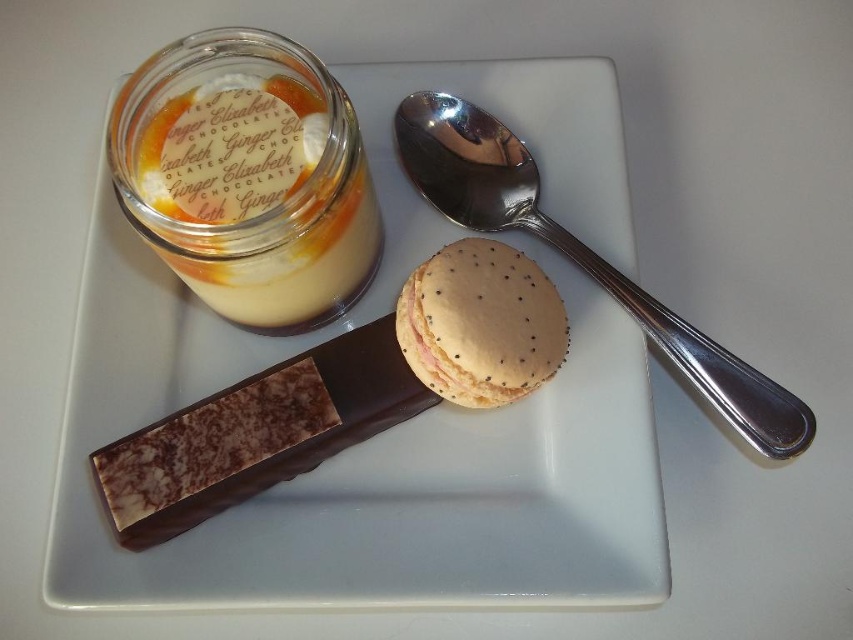
Question: Does silver metallic spoon at upper right have a lesser width compared to golden textured macaron at center?

Choices:
 (A) no
 (B) yes

Answer: (A)

Question: From the image, what is the correct spatial relationship of translucent glass jar at upper left in relation to silver metallic spoon at upper right?

Choices:
 (A) right
 (B) left

Answer: (B)

Question: Which point appears closest to the camera in this image?

Choices:
 (A) (410, 332)
 (B) (404, 444)
 (C) (685, 365)

Answer: (A)

Question: In this image, where is translucent glass jar at upper left located relative to silver metallic spoon at upper right?

Choices:
 (A) above
 (B) below

Answer: (A)

Question: Which object is the closest to the golden textured macaron at center?

Choices:
 (A) silver metallic spoon at upper right
 (B) translucent glass jar at upper left
 (C) white ceramic plate at center

Answer: (A)

Question: Which object appears closest to the camera in this image?

Choices:
 (A) silver metallic spoon at upper right
 (B) white ceramic plate at center
 (C) golden textured macaron at center
 (D) translucent glass jar at upper left

Answer: (D)